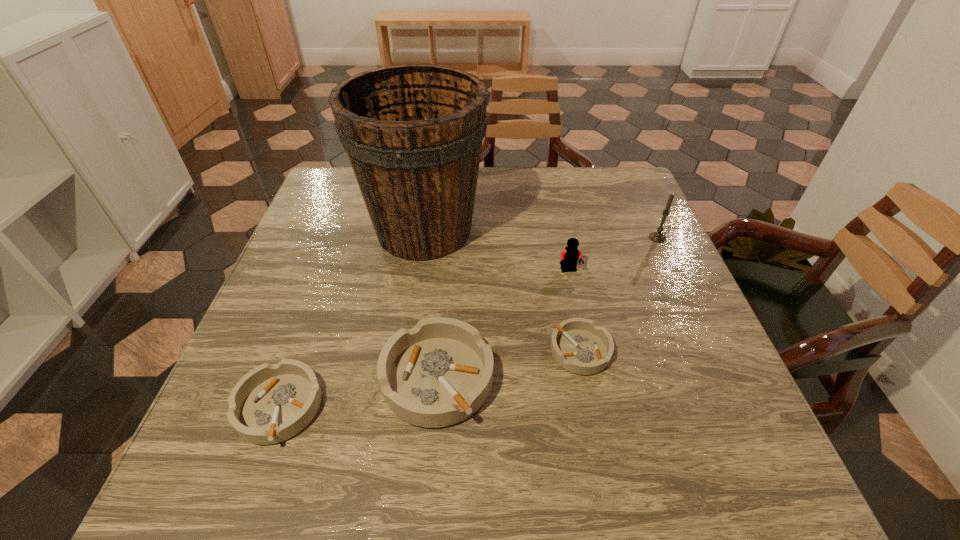
Where is `vacant space at the far edge of the desktop`? vacant space at the far edge of the desktop is located at coordinates (544, 190).

Identify the location of free spot at the near edge of the desktop. (645, 426).

At what (x,y) coordinates should I click in order to perform the action: click on free space at the left edge of the desktop. Please return your answer as a coordinate pair (x, y). Looking at the image, I should click on (345, 218).

Image resolution: width=960 pixels, height=540 pixels. Find the location of `vacant space at the right edge of the desktop`. vacant space at the right edge of the desktop is located at coordinates (651, 331).

I want to click on vacant space at the near left corner of the desktop, so click(224, 398).

In order to click on free space at the far right corner in this screenshot , I will do `click(588, 191)`.

Where is `free space between the tallest ashtray and the bucket`? The height and width of the screenshot is (540, 960). free space between the tallest ashtray and the bucket is located at coordinates (431, 304).

This screenshot has width=960, height=540. Find the location of `free spot between the third shortest object and the Lego`. free spot between the third shortest object and the Lego is located at coordinates (503, 324).

The width and height of the screenshot is (960, 540). I want to click on free space that is in between the shortest ashtray and the tallest object, so click(502, 291).

You are a GUI agent. You are given a task and a screenshot of the screen. Output one action in this format:
    pyautogui.click(x=<x>, y=<y>)
    Task: Click on the free space between the second ashtray from right to left and the Lego
    
    Given the screenshot: What is the action you would take?
    pyautogui.click(x=503, y=324)